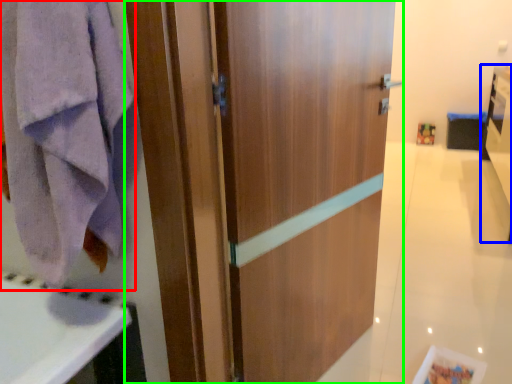
Question: Which is farther away from towel/napkin (highlighted by a red box)? vanity (highlighted by a blue box) or door (highlighted by a green box)?

Choices:
 (A) vanity
 (B) door

Answer: (A)